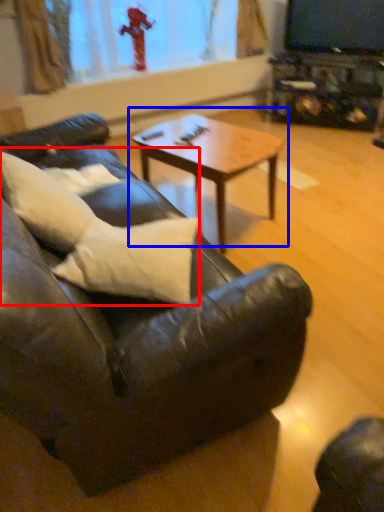
Question: Which point is further to the camera, pillow (highlighted by a red box) or coffee table (highlighted by a blue box)?

Choices:
 (A) pillow
 (B) coffee table

Answer: (B)